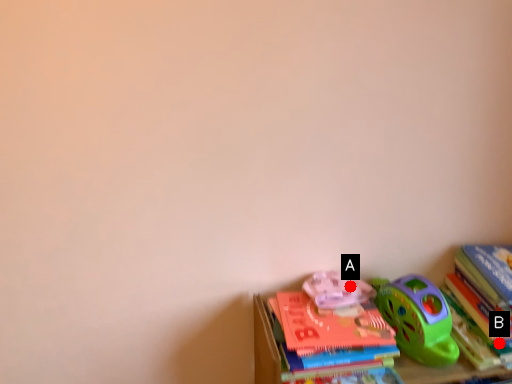
Question: Two points are circled on the image, labeled by A and B beside each circle. Which of the following is the closest to the observer?

Choices:
 (A) A is closer
 (B) B is closer

Answer: (B)